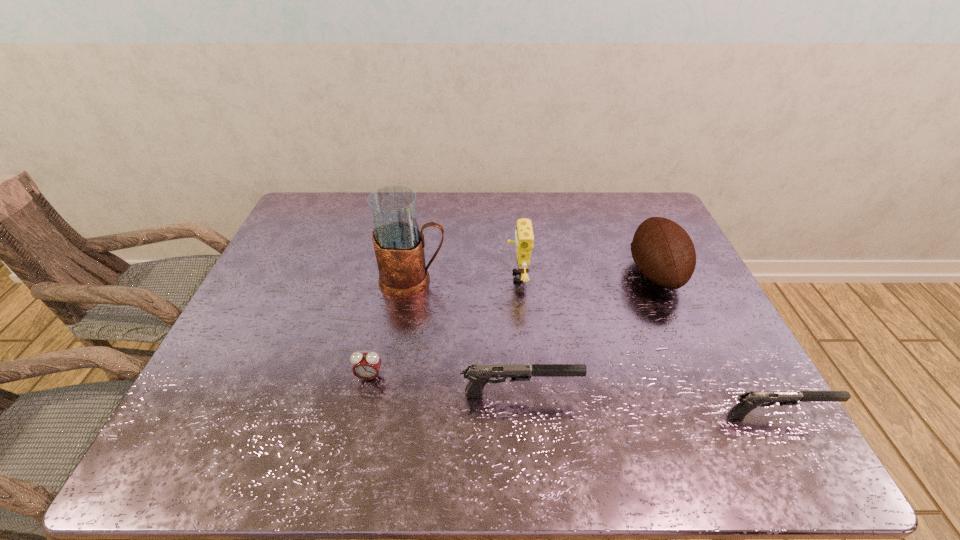
The height and width of the screenshot is (540, 960). I want to click on the second nearest object, so click(x=478, y=375).

Locate an element on the screen. This screenshot has height=540, width=960. the taller gun is located at coordinates (478, 375).

Locate an element on the screen. the nearest object is located at coordinates (749, 400).

Locate an element on the screen. the right gun is located at coordinates (749, 400).

This screenshot has height=540, width=960. Identify the location of the tallest object. (399, 245).

Where is `sponge`? The width and height of the screenshot is (960, 540). sponge is located at coordinates (524, 238).

Locate an element on the screen. Image resolution: width=960 pixels, height=540 pixels. football is located at coordinates (663, 251).

Find the location of a particular element. the fourth farthest object is located at coordinates (366, 366).

Locate an element on the screen. Image resolution: width=960 pixels, height=540 pixels. vacant area located at the muzzle end of the farther gun is located at coordinates (624, 393).

The image size is (960, 540). Find the location of `blank space located with the handle on the side of the tallest object`. blank space located with the handle on the side of the tallest object is located at coordinates (530, 280).